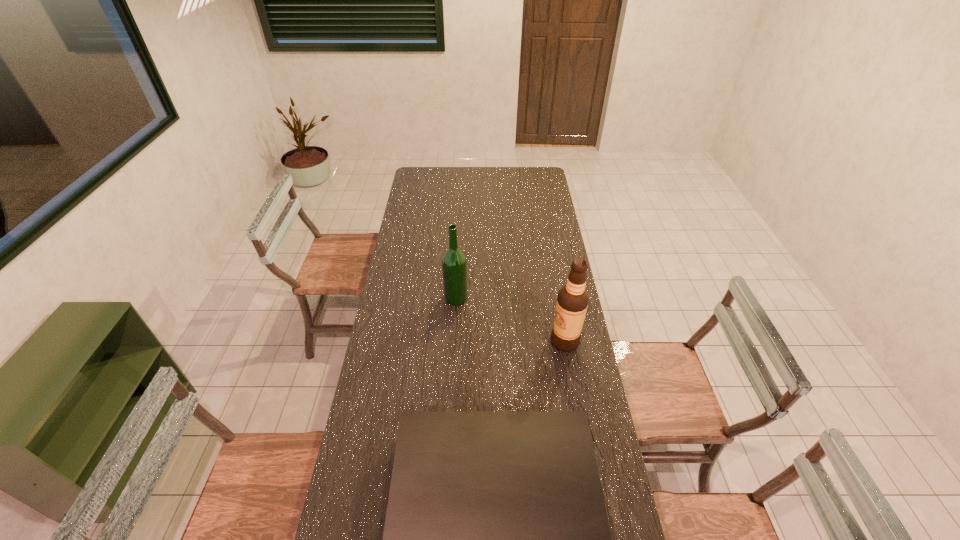
You are a GUI agent. You are given a task and a screenshot of the screen. Output one action in this format:
    pyautogui.click(x=<x>, y=<y>)
    Task: Click on the free spot at the left edge of the desktop
    The image size is (960, 540).
    Given the screenshot: What is the action you would take?
    pyautogui.click(x=412, y=293)

I want to click on vacant space at the right edge of the desktop, so click(554, 210).

Identify the location of free space at the far right corner. Image resolution: width=960 pixels, height=540 pixels. (532, 168).

Where is `free spot between the farthest object and the right alcohol`? This screenshot has width=960, height=540. free spot between the farthest object and the right alcohol is located at coordinates (511, 319).

Where is `free space between the farther alcohol and the right alcohol`? The image size is (960, 540). free space between the farther alcohol and the right alcohol is located at coordinates (511, 319).

Locate an element on the screen. blank region between the second farthest object and the left alcohol is located at coordinates (511, 319).

Locate an element on the screen. The height and width of the screenshot is (540, 960). object that is the second closest to the nearest object is located at coordinates (454, 262).

What are the coordinates of `object that is the closest to the CD player` in the screenshot? It's located at (572, 302).